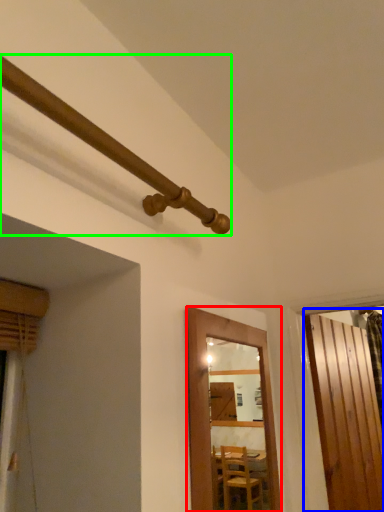
Question: Considering the real-world distances, which object is closest to door (highlighted by a red box)? door (highlighted by a blue box) or pipe (highlighted by a green box).

Choices:
 (A) door
 (B) pipe

Answer: (B)